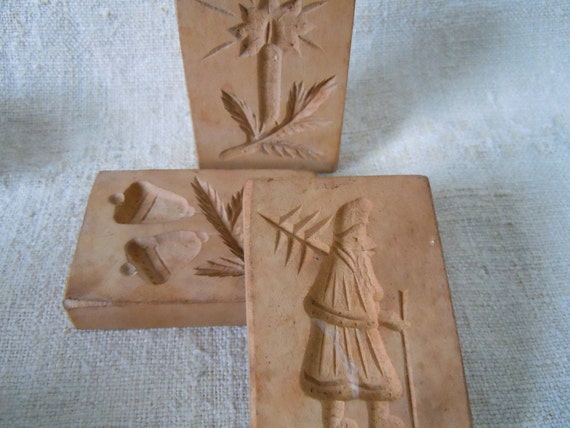
I want to click on cushion, so click(484, 218).